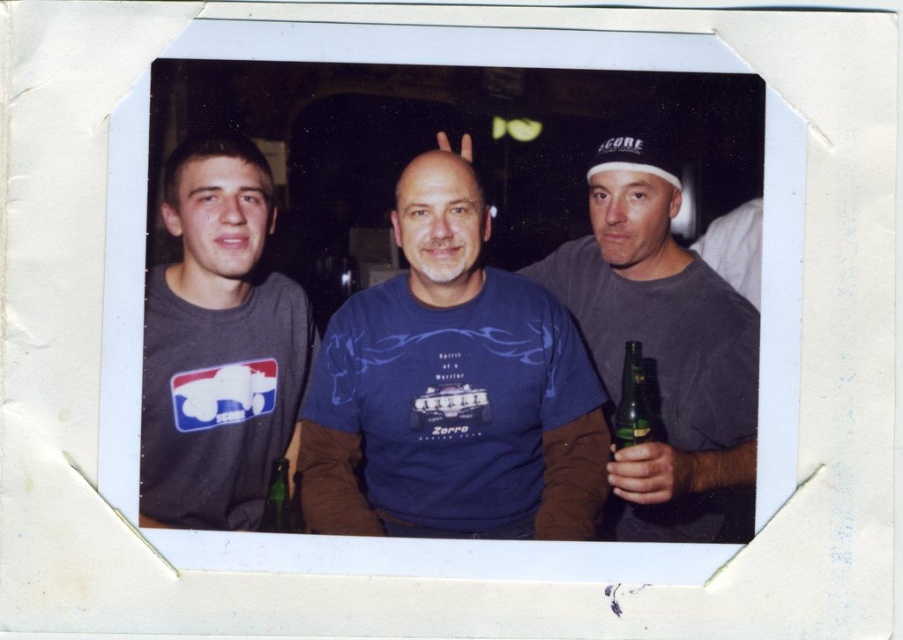
You are standing in front of the Polaroid photograph and want to touch the point at coordinates point (510,456). To do this, you must first move your hand past the point at point (286,531). Is this necessary?

Yes, because point (510,456) is behind point (286,531), so you must move your hand past the latter to reach the former.